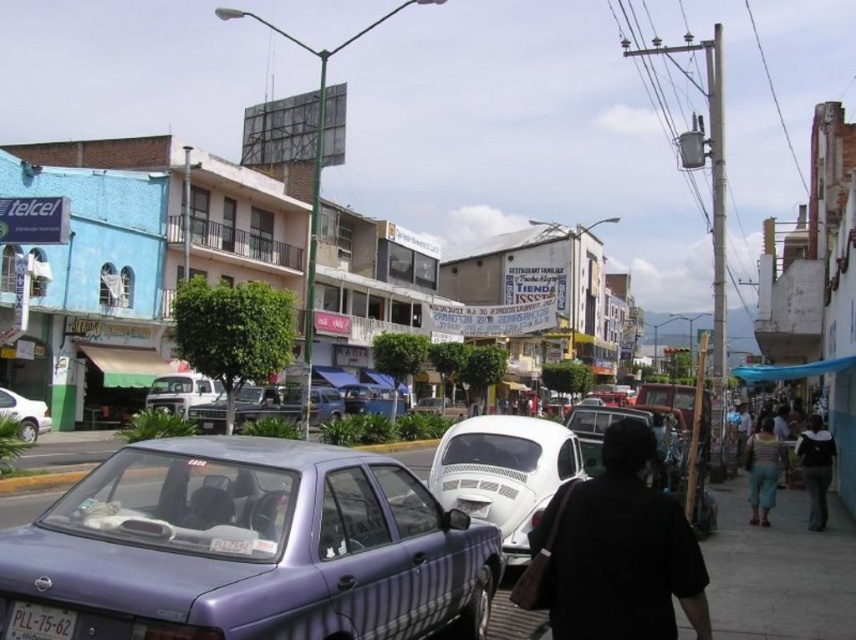
Can you confirm if denim shorts at lower right is shorter than dark blue jeans at lower right?

Correct, denim shorts at lower right is not as tall as dark blue jeans at lower right.

Who is more distant from viewer, (749, 483) or (803, 435)?

Point (749, 483)

Find the location of a particular element. denim shorts at lower right is located at coordinates (762, 470).

Can you confirm if metallic silver truck at center is shorter than matte white truck at center?

Yes.

Which is above, metallic silver truck at center or matte white truck at center?

matte white truck at center is above.

Identify the location of metallic silver truck at center. The image size is (856, 640). (254, 403).

Where is `metallic silver truck at center`? This screenshot has width=856, height=640. metallic silver truck at center is located at coordinates (254, 403).

Does denim shorts at lower right have a lesser height compared to metallic silver van at center?

Indeed, denim shorts at lower right has a lesser height compared to metallic silver van at center.

Does point (755, 524) lie in front of point (569, 410)?

Yes, it is in front of point (569, 410).

Identify the location of denim shorts at lower right. tap(762, 470).